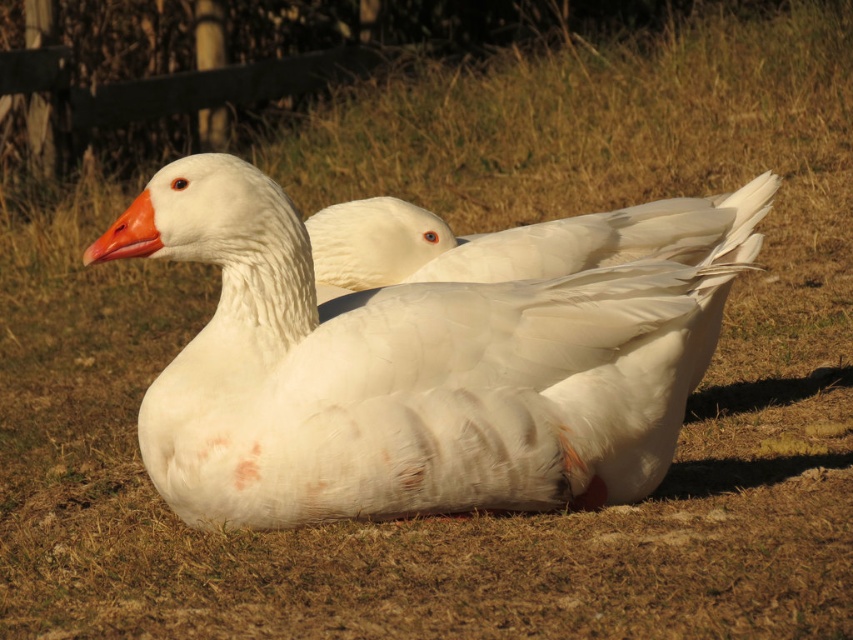
How much distance is there between white feathered goose at center and orange matte beak at center?

The distance of white feathered goose at center from orange matte beak at center is 1.32 meters.

Is white feathered goose at center thinner than orange matte beak at center?

No.

Is point (334, 282) positioned behind point (144, 192)?

Yes, point (334, 282) is behind point (144, 192).

This screenshot has width=853, height=640. I want to click on white feathered goose at center, so click(x=521, y=240).

Consider the image. Who is taller, white feathered duck at center or white feathered goose at center?

Standing taller between the two is white feathered duck at center.

Is point (579, 378) farther from viewer compared to point (756, 192)?

No, it is not.

This screenshot has height=640, width=853. What are the coordinates of `white feathered duck at center` in the screenshot? It's located at (410, 374).

Does white feathered duck at center appear on the left side of orange matte beak at center?

In fact, white feathered duck at center is to the right of orange matte beak at center.

Is white feathered duck at center bigger than orange matte beak at center?

Yes, white feathered duck at center is bigger than orange matte beak at center.

Based on the photo, who is more distant from viewer, (546, 314) or (108, 234)?

The point (108, 234) is behind.

Locate an element on the screen. white feathered duck at center is located at coordinates (410, 374).